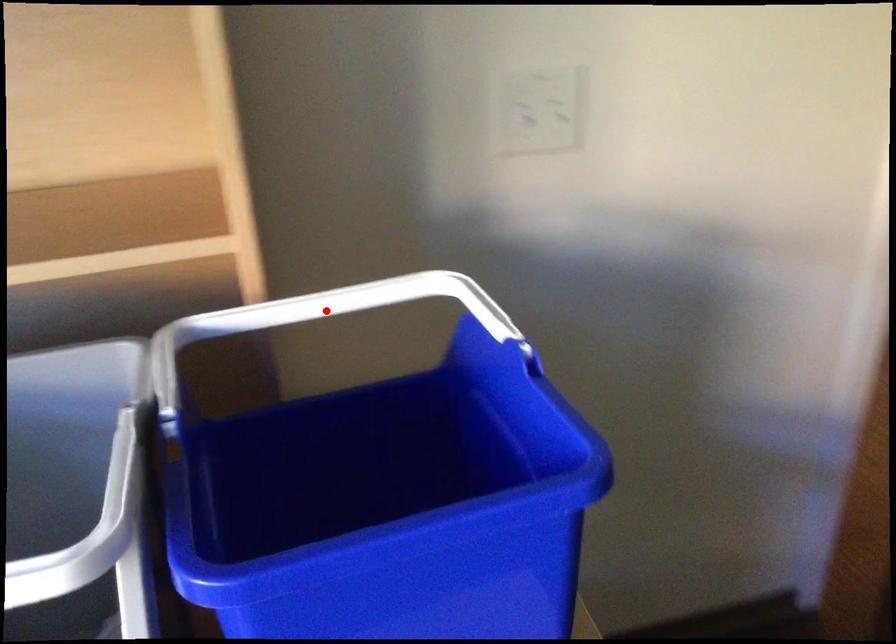
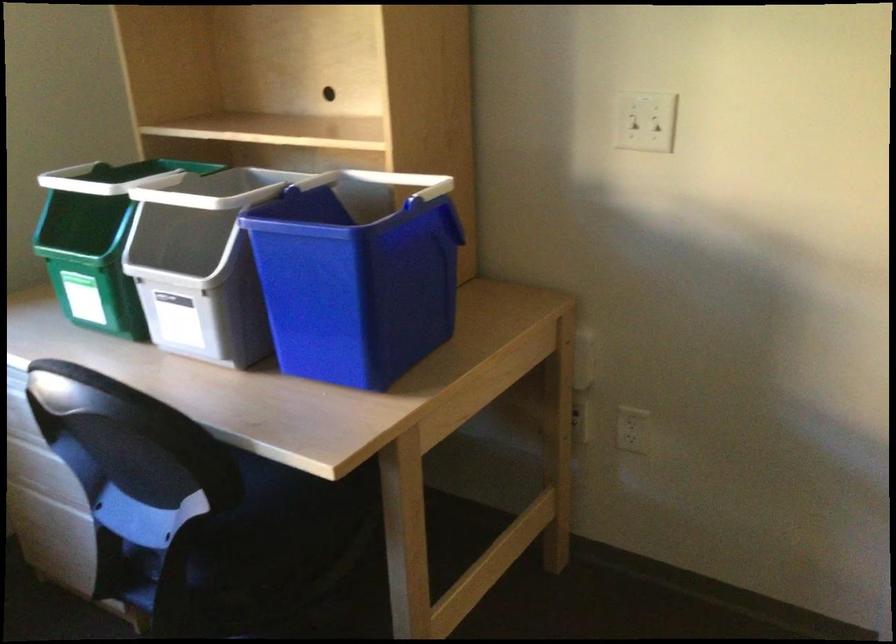
Question: I am providing you with two images of the same scene from different viewpoints. In image1, a red point is highlighted. Considering the same 3D point in image2, which of the following is correct?

Choices:
 (A) It is closer
 (B) It is farther

Answer: (B)